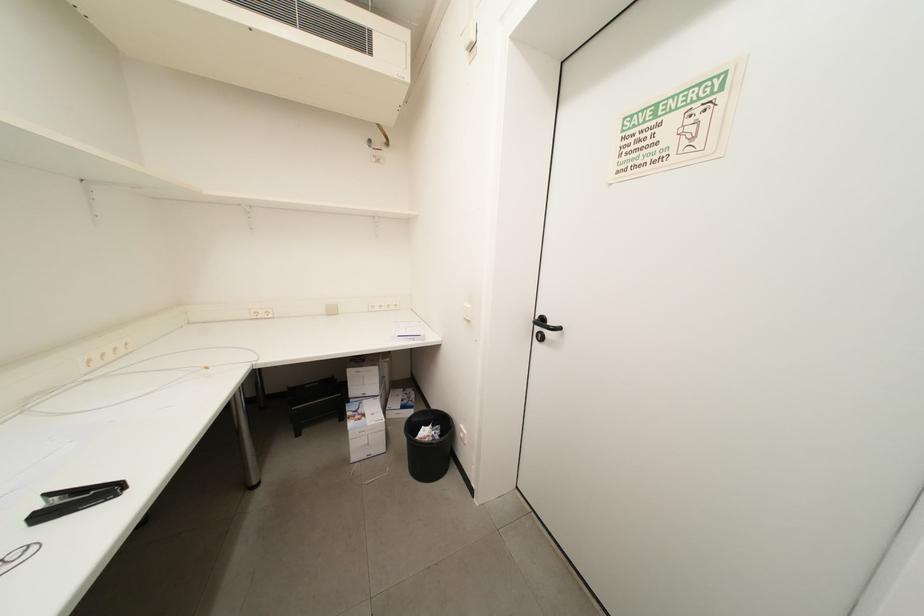
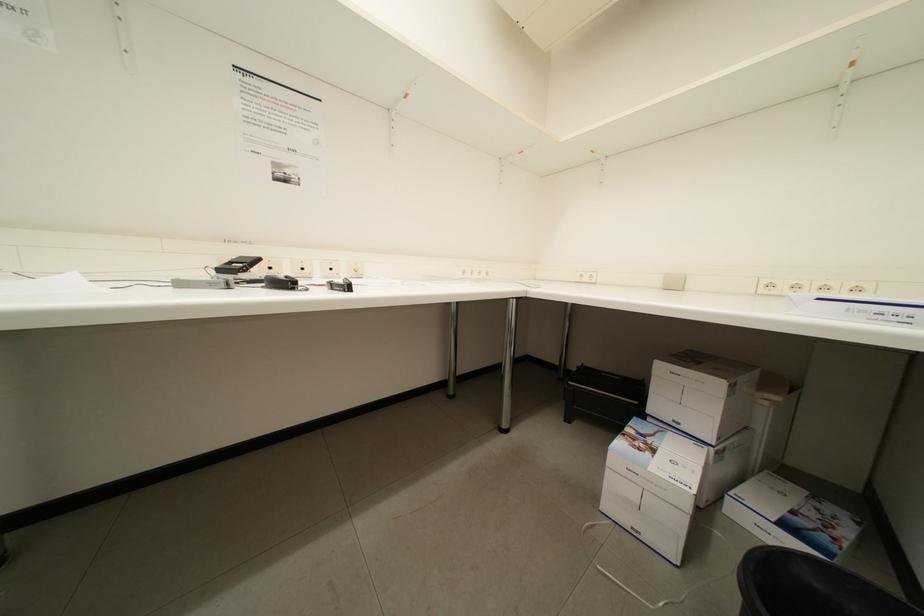
Question: Based on the continuous images, in which direction is the camera rotating? Reply with the corresponding letter.

Choices:
 (A) Left
 (B) Right
 (C) Up
 (D) Down

Answer: (A)